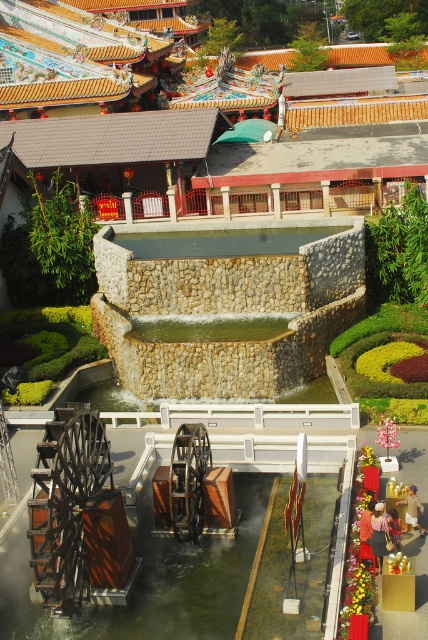
Measure the distance between matte brown temple at upper center and wooden waterwheel at lower center.

matte brown temple at upper center and wooden waterwheel at lower center are 41.41 meters apart.

Which is above, matte brown temple at upper center or wooden waterwheel at lower center?

matte brown temple at upper center is higher up.

Is point (64, 26) farther from camera compared to point (5, 556)?

Yes, it is behind point (5, 556).

Locate an element on the screen. matte brown temple at upper center is located at coordinates (112, 64).

Between stone textured fountain at center and matte brown temple at upper center, which one has more height?

matte brown temple at upper center is taller.

Based on the photo, can you confirm if stone textured fountain at center is bigger than matte brown temple at upper center?

No, stone textured fountain at center is not bigger than matte brown temple at upper center.

Is point (193, 307) more distant than point (231, 61)?

No, it is in front of (231, 61).

I want to click on stone textured fountain at center, so click(228, 310).

Does stone textured fountain at center come in front of wooden waterwheel at lower center?

No, stone textured fountain at center is further to the viewer.

Measure the distance between stone textured fountain at center and camera.

The distance of stone textured fountain at center from camera is 99.07 feet.

Where is `stone textured fountain at center`? The height and width of the screenshot is (640, 428). stone textured fountain at center is located at coordinates (228, 310).